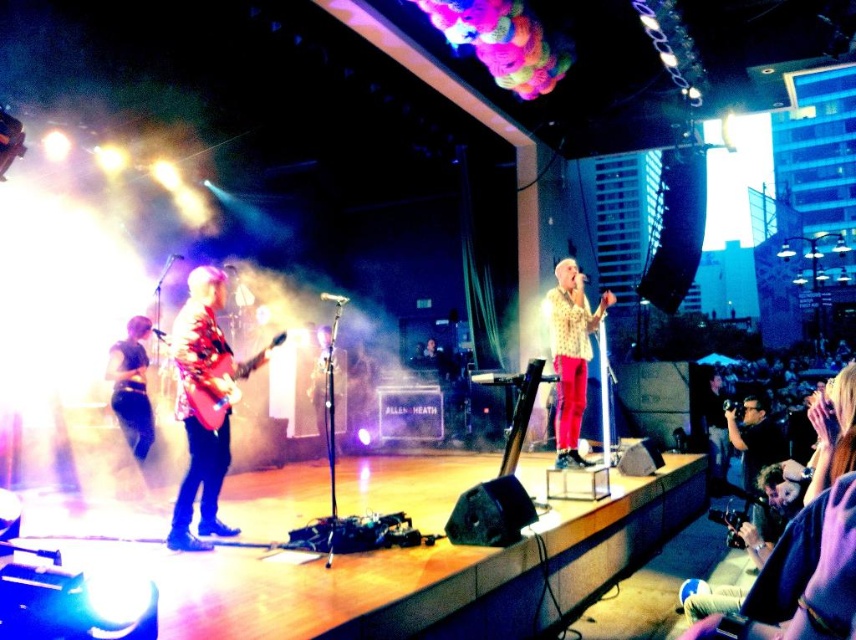
Consider the image. Does floral-patterned shirt at center have a lesser height compared to shiny red electric guitar at center-left?

In fact, floral-patterned shirt at center may be taller than shiny red electric guitar at center-left.

Where is `floral-patterned shirt at center`? The height and width of the screenshot is (640, 856). floral-patterned shirt at center is located at coordinates (571, 355).

How far apart are floral-patterned shirt at center and black fabric pants at lower left?

The distance of floral-patterned shirt at center from black fabric pants at lower left is 10.80 feet.

Is floral-patterned shirt at center to the right of black fabric pants at lower left from the viewer's perspective?

Correct, you'll find floral-patterned shirt at center to the right of black fabric pants at lower left.

Is point (560, 412) positioned before point (110, 360)?

That is False.

Where is `floral-patterned shirt at center`? The height and width of the screenshot is (640, 856). floral-patterned shirt at center is located at coordinates (571, 355).

The height and width of the screenshot is (640, 856). Find the location of `black fabric pants at lower left`. black fabric pants at lower left is located at coordinates (131, 387).

Is black fabric pants at lower left positioned behind shiny red electric guitar at center-left?

Yes.

Describe the element at coordinates (131, 387) in the screenshot. I see `black fabric pants at lower left` at that location.

The width and height of the screenshot is (856, 640). In order to click on black fabric pants at lower left in this screenshot , I will do `click(131, 387)`.